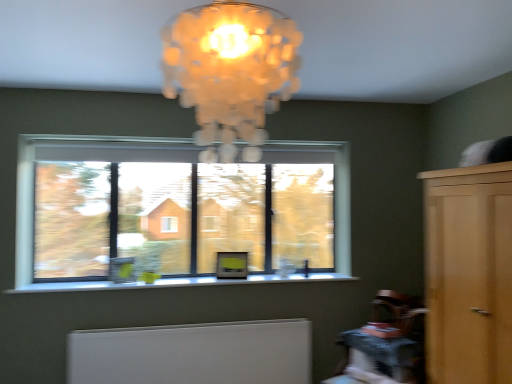
Question: Does light brown wood dresser at right have a larger size compared to white matte radiator at lower center?

Choices:
 (A) no
 (B) yes

Answer: (B)

Question: Does light brown wood dresser at right have a smaller size compared to white matte radiator at lower center?

Choices:
 (A) no
 (B) yes

Answer: (A)

Question: Can you confirm if light brown wood dresser at right is wider than white matte radiator at lower center?

Choices:
 (A) no
 (B) yes

Answer: (B)

Question: Is light brown wood dresser at right positioned behind white matte radiator at lower center?

Choices:
 (A) no
 (B) yes

Answer: (A)

Question: Is light brown wood dresser at right aimed at white matte radiator at lower center?

Choices:
 (A) yes
 (B) no

Answer: (B)

Question: Is light brown wood dresser at right facing away from white matte radiator at lower center?

Choices:
 (A) yes
 (B) no

Answer: (B)

Question: Is translucent glass chandelier at upper center positioned beyond the bounds of wooden textured table at lower right?

Choices:
 (A) no
 (B) yes

Answer: (B)

Question: From the image's perspective, is translucent glass chandelier at upper center located above wooden textured table at lower right?

Choices:
 (A) no
 (B) yes

Answer: (B)

Question: Considering the relative sizes of translucent glass chandelier at upper center and wooden textured table at lower right in the image provided, is translucent glass chandelier at upper center smaller than wooden textured table at lower right?

Choices:
 (A) yes
 (B) no

Answer: (B)

Question: From a real-world perspective, is translucent glass chandelier at upper center physically above wooden textured table at lower right?

Choices:
 (A) yes
 (B) no

Answer: (A)

Question: Is translucent glass chandelier at upper center further to the viewer compared to wooden textured table at lower right?

Choices:
 (A) yes
 (B) no

Answer: (B)

Question: Does translucent glass chandelier at upper center lie in front of wooden textured table at lower right?

Choices:
 (A) yes
 (B) no

Answer: (A)

Question: From a real-world perspective, is translucent glass chandelier at upper center on top of light brown wood dresser at right?

Choices:
 (A) no
 (B) yes

Answer: (B)